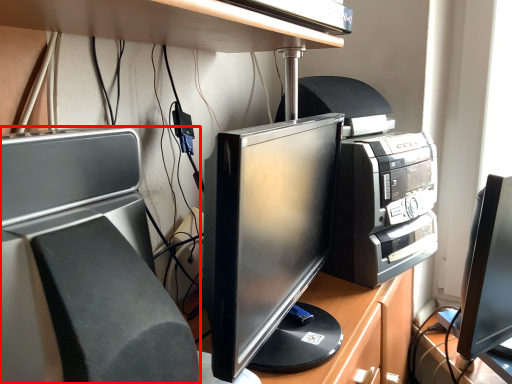
Question: From the image's perspective, considering the relative positions of home appliance (annotated by the red box) and desk in the image provided, where is home appliance (annotated by the red box) located with respect to the staircase?

Choices:
 (A) below
 (B) above

Answer: (A)